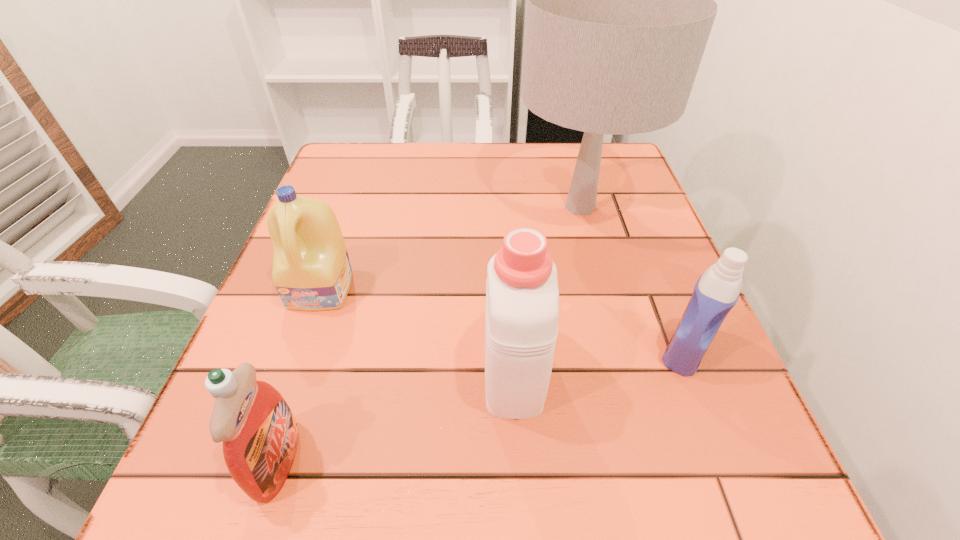
Identify the location of vacant region located 0.370m on the handle side of the tallest detergent. (502, 198).

The height and width of the screenshot is (540, 960). Find the location of `free space located on the handle side of the tallest detergent`. free space located on the handle side of the tallest detergent is located at coordinates (508, 281).

Find the location of a particular element. blank space located on the label of the farthest detergent is located at coordinates (304, 340).

You are a GUI agent. You are given a task and a screenshot of the screen. Output one action in this format:
    pyautogui.click(x=<x>, y=<y>)
    Task: Click on the free spot located 0.150m on the back of the rightmost detergent
    The image size is (960, 540).
    Given the screenshot: What is the action you would take?
    pyautogui.click(x=651, y=266)

Identify the location of object situated at the far edge. (620, 4).

At what (x,y) coordinates should I click in order to perform the action: click on object present at the near edge. Please return your answer as a coordinate pair (x, y). Looking at the image, I should click on (259, 432).

Locate an element on the screen. The width and height of the screenshot is (960, 540). lampshade present at the right edge is located at coordinates (620, 4).

I want to click on detergent located at the right edge, so click(716, 292).

Identify the location of object that is at the near left corner. The height and width of the screenshot is (540, 960). (259, 432).

I want to click on object that is at the far right corner, so click(620, 4).